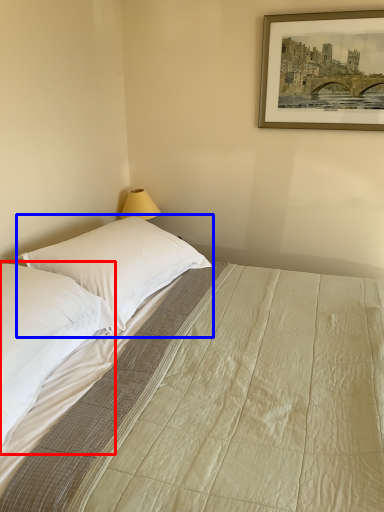
Question: Among these objects, which one is nearest to the camera, pillow (highlighted by a red box) or pillow (highlighted by a blue box)?

Choices:
 (A) pillow
 (B) pillow

Answer: (A)